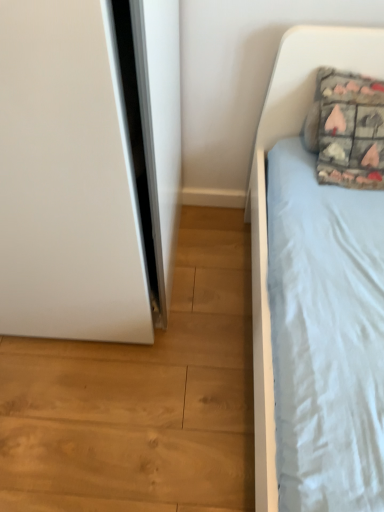
You are a GUI agent. You are given a task and a screenshot of the screen. Output one action in this format:
    pyautogui.click(x=<x>, y=<y>)
    Task: Click on the textured fabric pillow at upper right
    This screenshot has height=512, width=384.
    Given the screenshot: What is the action you would take?
    pyautogui.click(x=347, y=130)

This screenshot has width=384, height=512. Describe the element at coordinates (347, 130) in the screenshot. I see `textured fabric pillow at upper right` at that location.

You are a GUI agent. You are given a task and a screenshot of the screen. Output one action in this format:
    pyautogui.click(x=<x>, y=<y>)
    Task: Click on the textured fabric pillow at upper right
    The height and width of the screenshot is (512, 384).
    Given the screenshot: What is the action you would take?
    pyautogui.click(x=347, y=130)